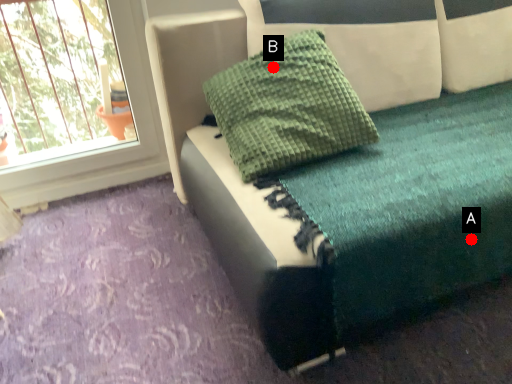
Question: Two points are circled on the image, labeled by A and B beside each circle. Which point appears closest to the camera in this image?

Choices:
 (A) A is closer
 (B) B is closer

Answer: (A)